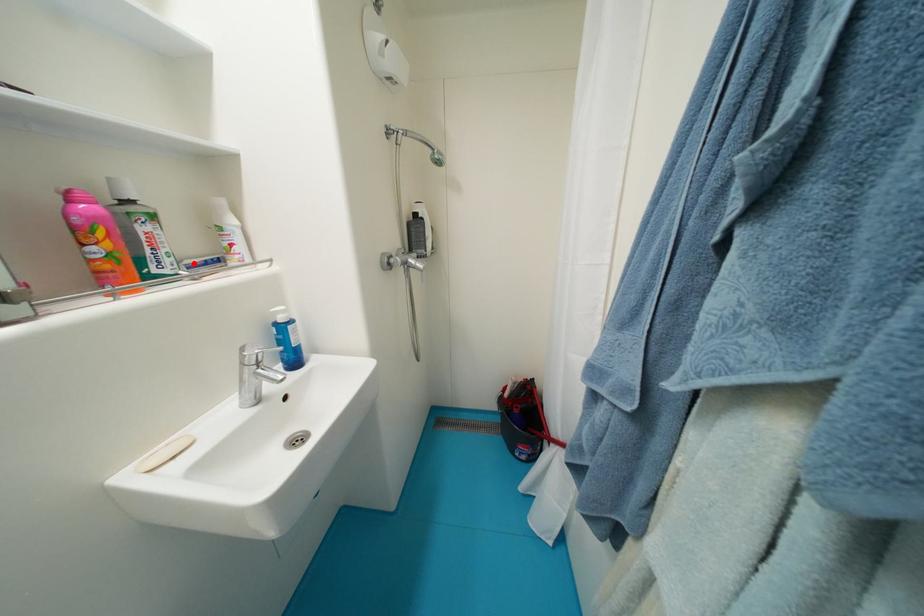
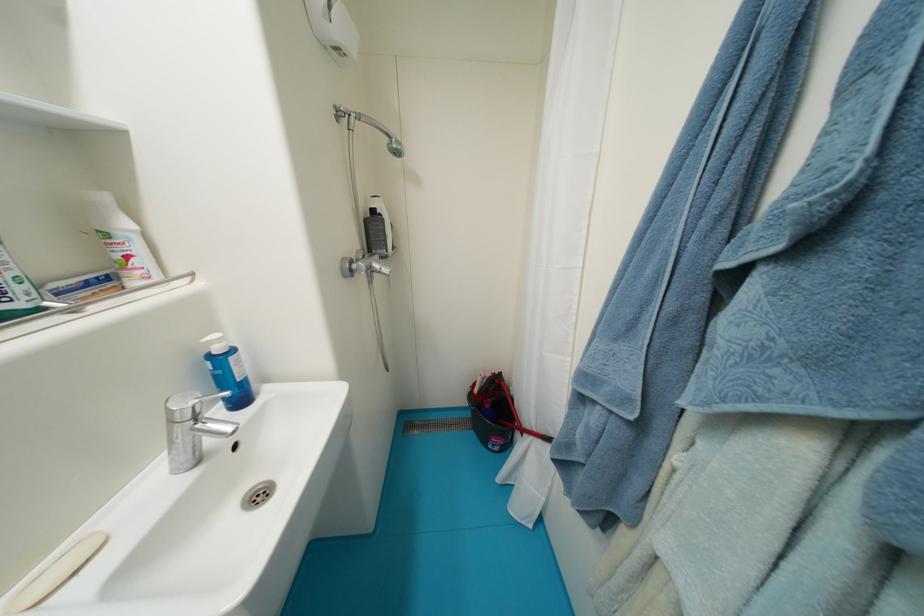
Find the pixel in the second image that matches the highlighted location in the first image.

(61, 286)